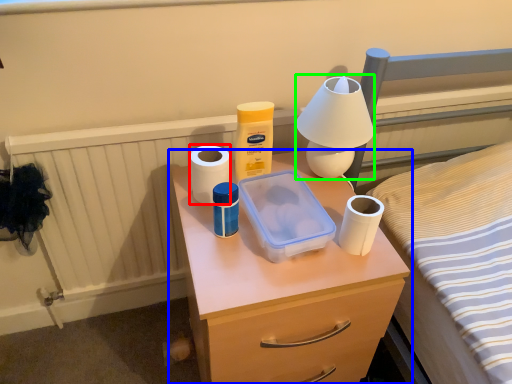
Question: Which object is the farthest from toilet paper (highlighted by a red box)? Choose among these: chest of drawers (highlighted by a blue box) or table lamp (highlighted by a green box).

Choices:
 (A) chest of drawers
 (B) table lamp

Answer: (A)